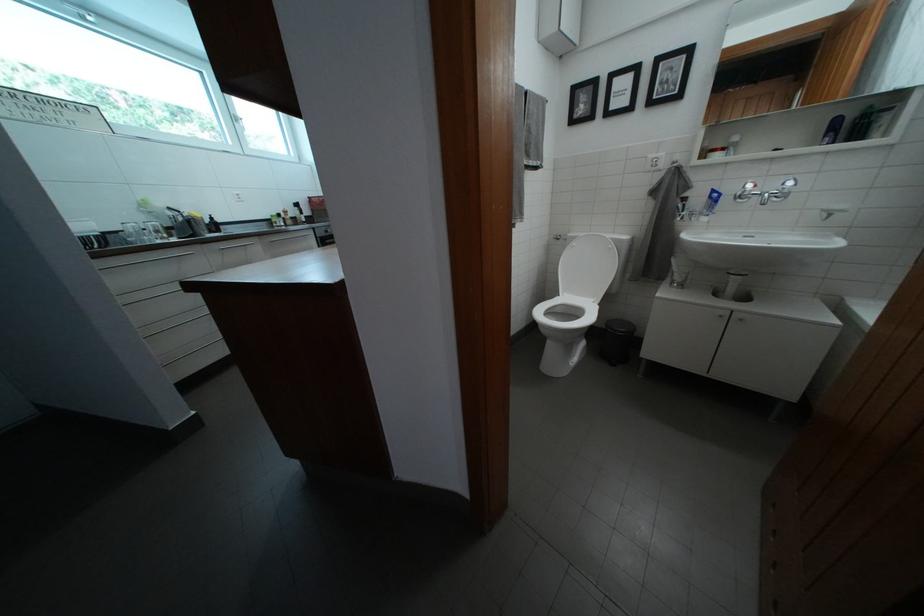
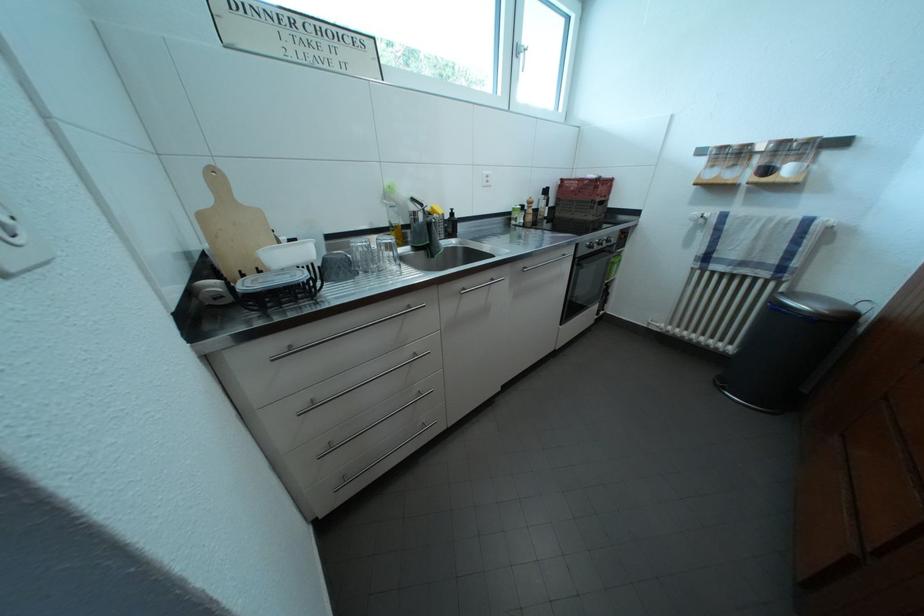
Locate, in the second image, the point that corresponds to pixel 322 235 in the first image.

(587, 251)